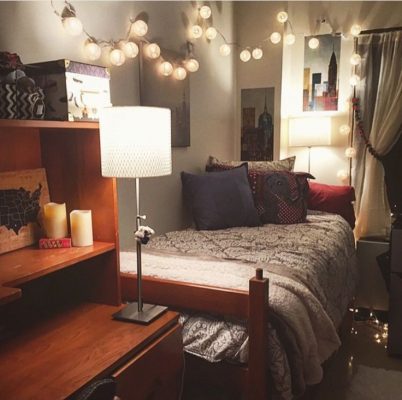
Where is `lamp`? Image resolution: width=402 pixels, height=400 pixels. lamp is located at coordinates (117, 163).